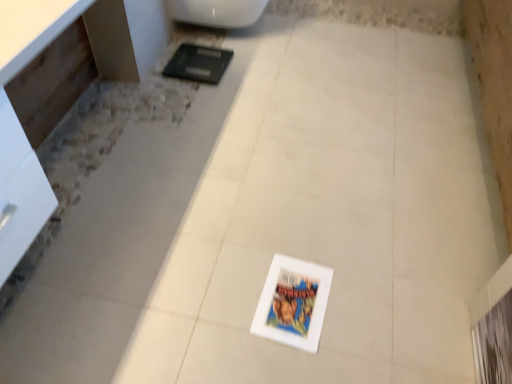
Question: Looking at their shapes, would you say white glossy toilet at upper center is wider or thinner than white glossy vanity at left?

Choices:
 (A) thin
 (B) wide

Answer: (B)

Question: Is point (200, 16) positioned closer to the camera than point (145, 44)?

Choices:
 (A) farther
 (B) closer

Answer: (A)

Question: Is white glossy toilet at upper center in front of or behind white glossy vanity at left in the image?

Choices:
 (A) front
 (B) behind

Answer: (B)

Question: In terms of height, does white glossy vanity at left look taller or shorter compared to white glossy toilet at upper center?

Choices:
 (A) short
 (B) tall

Answer: (B)

Question: Would you say white glossy vanity at left is to the left or to the right of white glossy toilet at upper center in the picture?

Choices:
 (A) left
 (B) right

Answer: (A)

Question: In the image, is white glossy vanity at left positioned in front of or behind white glossy toilet at upper center?

Choices:
 (A) behind
 (B) front

Answer: (B)

Question: From the image's perspective, relative to white glossy toilet at upper center, is white glossy vanity at left above or below?

Choices:
 (A) below
 (B) above

Answer: (A)